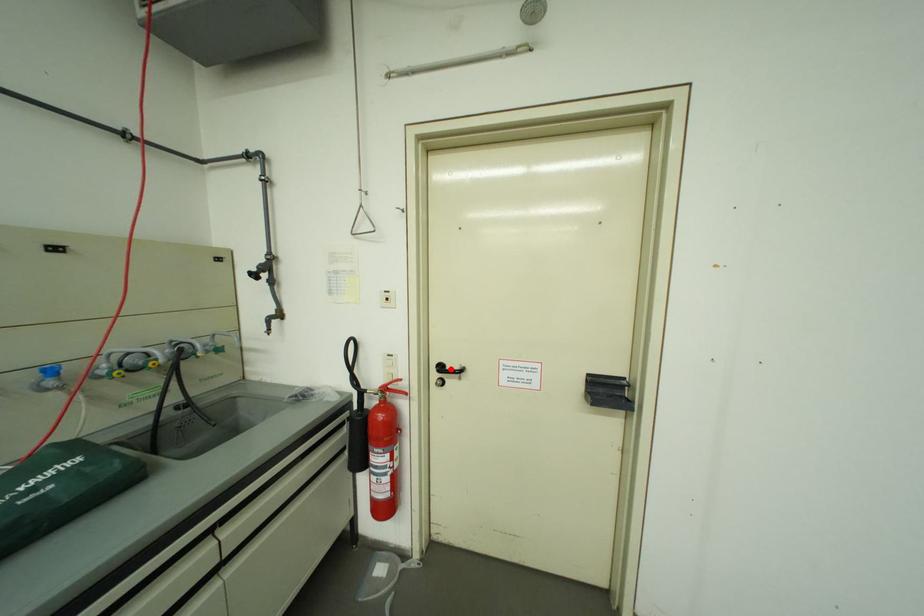
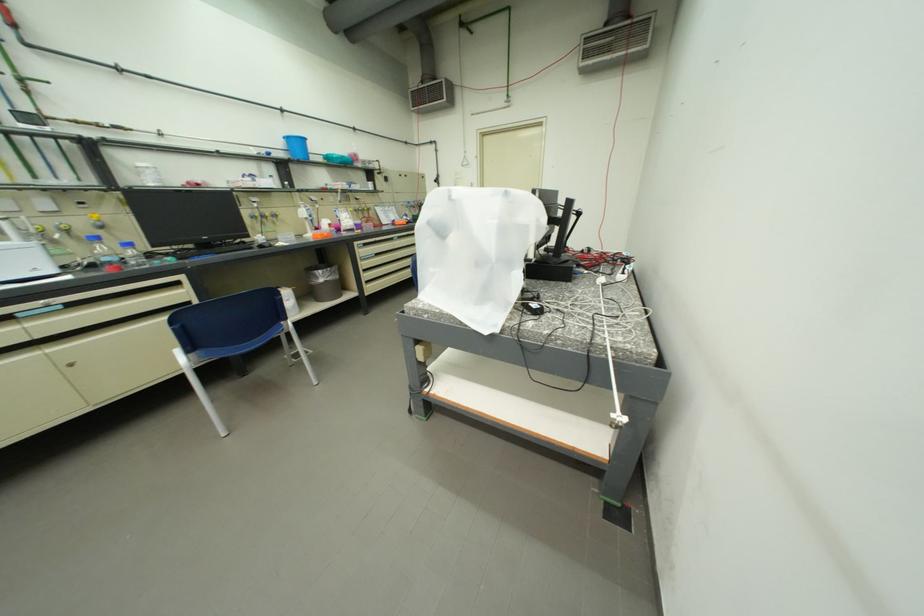
Question: I am providing you with two images of the same scene from different viewpoints. A red point is marked on the first image. Can you still see the location of the red point in image 2?

Choices:
 (A) Yes
 (B) No

Answer: (B)